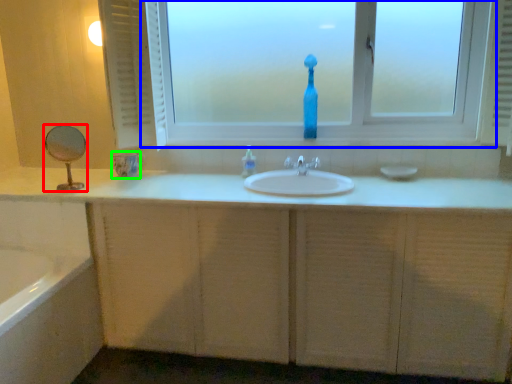
Question: Which object is positioned closest to mirror (highlighted by a red box)? Select from window (highlighted by a blue box) and glass vase (highlighted by a green box).

Choices:
 (A) window
 (B) glass vase

Answer: (B)